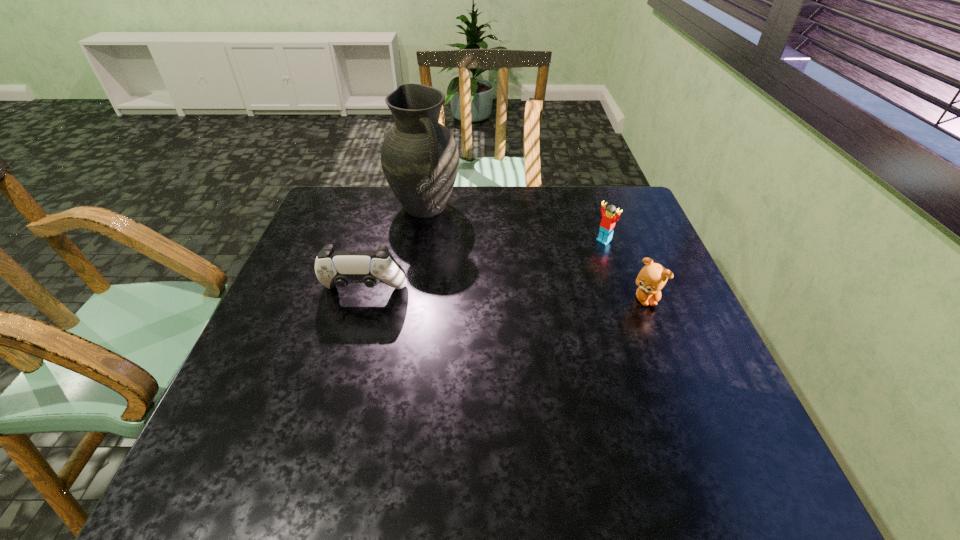
In order to click on vacant spot on the desktop that is between the control and the teddy bear and is positioned on the side of the tallest object with the handle in this screenshot , I will do `click(487, 295)`.

This screenshot has width=960, height=540. In order to click on free spot on the desktop that is between the control and the teddy bear and is positioned on the face of the second farthest object in this screenshot , I will do `click(521, 296)`.